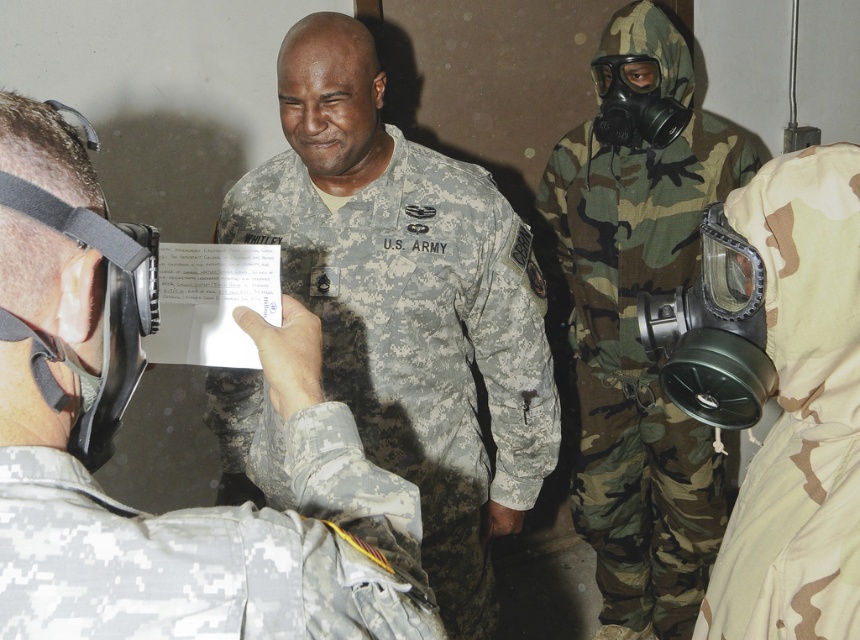
You are standing at the point marked by the coordinates point (x=342, y=305) and want to move to the nearest exit, which is 10 feet away. Can you reach the exit without moving more than 5 feet?

The distance between point (x=342, y=305) and the viewer is 5.85 feet. Since the exit is 10 feet away and you can only move 5 feet, you cannot reach the exit from your current position.

You are a military inspector reviewing the uniforms in the image. You notice two uniforms labeled as camouflage uniform at center and camouflage fabric us army uniform at center. According to the description, which one is positioned higher?

The camouflage uniform at center is located above the camouflage fabric us army uniform at center, so it is positioned higher.

You are a military medic in the field and need to quickly assess the distance between the two uniforms. Can you determine if the camouflage uniform at center is closer to you than the camouflage fabric us army uniform at center?

The camouflage uniform at center is 37.96 inches away from the camouflage fabric us army uniform at center. Since the distance between them is 37.96 inches, the camouflage uniform at center is closer to you than the camouflage fabric us army uniform at center if you are positioned between them. However, without knowing your exact position relative to both uniforms, it is impossible to definitively determine which is closer. Please clarify your position for an accurate assessment.